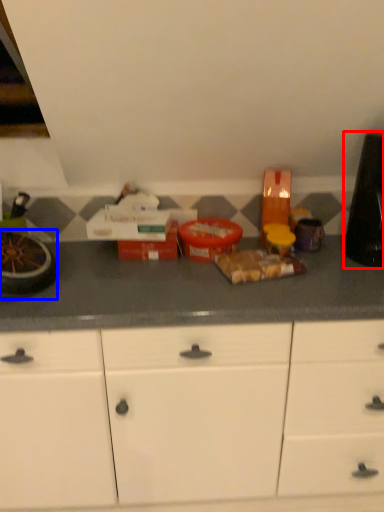
Question: Among these objects, which one is nearest to the camera, appliance (highlighted by a red box) or appliance (highlighted by a blue box)?

Choices:
 (A) appliance
 (B) appliance

Answer: (B)